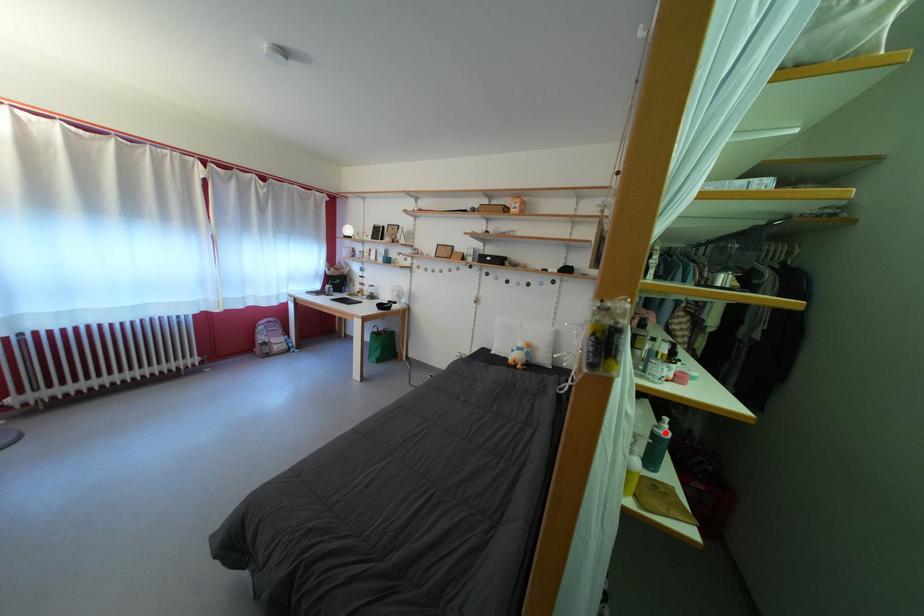
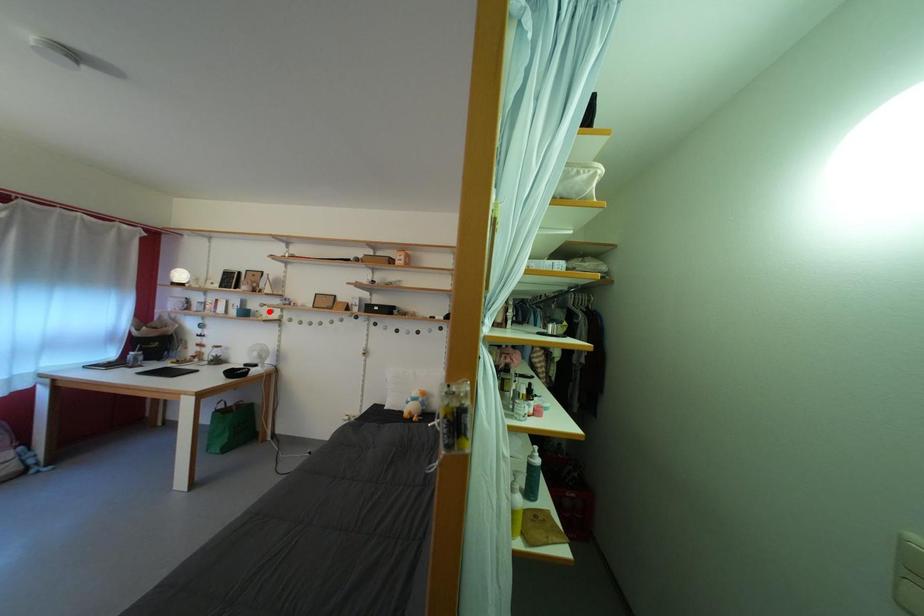
I am providing you with two images of the same scene from different viewpoints. A red point is marked on the first image and another point is marked on the second image. Does the point marked in image1 correspond to the same location as the one in image2?

No